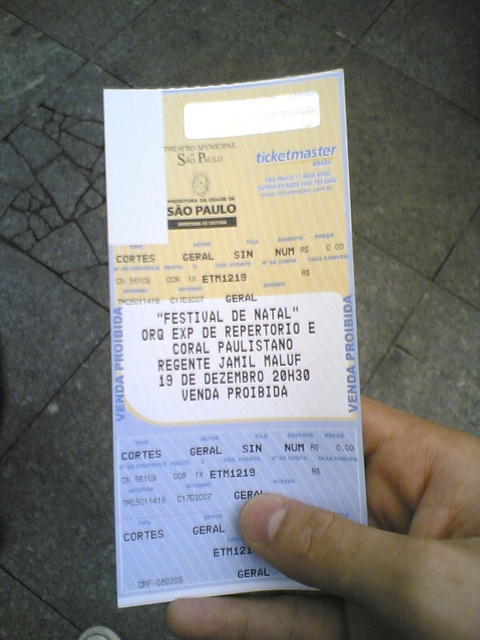
You are a photographer trying to capture the ticket details clearly. The ticket is held at a point [348,275]. If your camera is 16.06 inches away from this point, will you be able to capture the entire ticket in the frame?

The point at [348,275] is 16.06 inches away from the camera. Since the camera is positioned at this distance, it should be able to capture the entire ticket in the frame as long as the lens and framing are adjusted properly.

You are holding a camera 10 inches away from your face. You want to take a photo of the white paper ticket at center without moving your head. Can you focus on the ticket clearly?

The white paper ticket at center is 15.17 inches away from viewer. Since your camera is 10 inches away from your face, the distance between the camera and the ticket would be 15.17 minus 10 inches, which is 5.17 inches. Most cameras have a minimum focusing distance of about 8 inches, so it might be too close to focus properly. You might need to move the camera back or adjust your position to ensure the ticket is in focus.

You are a photographer trying to capture a closeup of the white paper ticket at center. You need to ensure that the skinny white hand at lower right does not block the ticket in the photo. Based on the scene, can you determine if the hand will interfere with the ticket in the image?

The distance between the white paper ticket at center and the skinny white hand at lower right is 8.36 centimeters. Since the hand is 8.36 centimeters away from the ticket, it is unlikely to block the ticket in the photo unless the camera angle or focus is adjusted to include the hand in the frame.